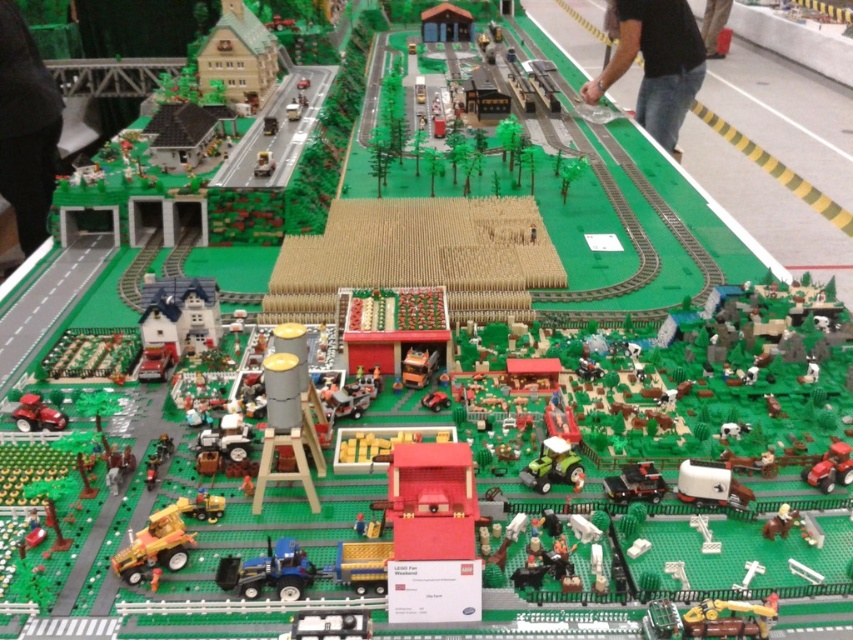
You are a farmer who needs to decide which tractor to use for a large field. Based on the Lego model, which tractor between the blue plastic tractor at center and the green matte tractor at center would you choose and why?

The blue plastic tractor at center is bigger than the green matte tractor at center, so the farmer should choose the blue plastic tractor at center for the large field because it is larger and likely more capable of handling bigger tasks.

You are standing at the point marked at coordinates point (840, 477). You want to walk to the red barn with white roof in the center of the model. The shortest path requires moving through the Lego farm model. The caution zones are marked with yellow and black stripes on the tracks. What is the minimum distance you need to walk to reach the red barn with white roof?

The minimum distance you need to walk to reach the red barn with white roof is 36.10 inches.